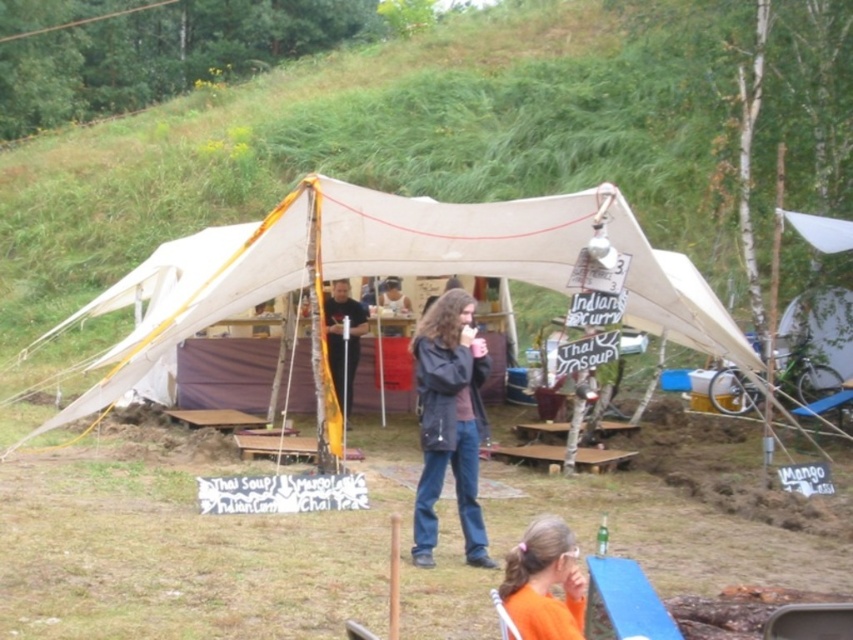
Question: In this image, where is beige canvas tent at center located relative to matte black jacket at center?

Choices:
 (A) below
 (B) above

Answer: (B)

Question: Which object appears farthest from the camera in this image?

Choices:
 (A) orange fabric at lower center
 (B) dark gray jacket at center
 (C) beige canvas tent at center

Answer: (C)

Question: Does dark gray jacket at center lie behind orange fabric at lower center?

Choices:
 (A) yes
 (B) no

Answer: (A)

Question: Which object is positioned farthest from the matte black jacket at center?

Choices:
 (A) beige canvas tent at center
 (B) dark gray jacket at center

Answer: (B)

Question: Is beige canvas tent at center thinner than orange fabric at lower center?

Choices:
 (A) yes
 (B) no

Answer: (B)

Question: Based on their relative distances, which object is farther from the matte black jacket at center?

Choices:
 (A) orange fabric at lower center
 (B) dark gray jacket at center

Answer: (A)